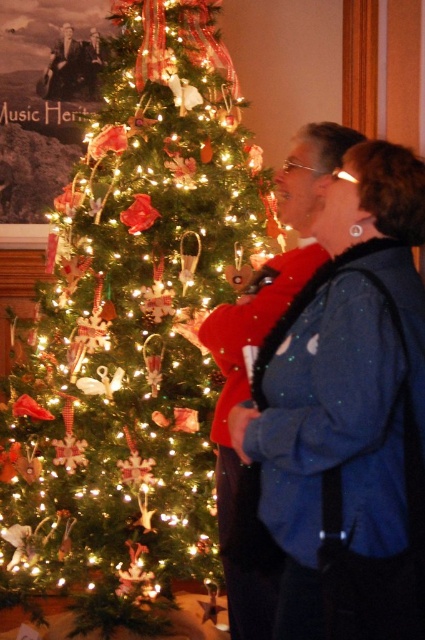
Consider the image. You are planning to take a photo of the green matte christmas tree at left and the blue sequined jacket at center. Which object should you focus on first if you want to capture both in the same frame without moving the camera?

The green matte christmas tree at left is larger in size than the blue sequined jacket at center, so you should focus on the tree first to ensure it fits properly in the frame before adjusting for the jacket.

You are standing in front of the Christmas tree and want to take a photo of the blue sequined jacket at center and the green matte christmas tree at left. Can you see both objects clearly in the photo without any obstruction?

The blue sequined jacket at center is behind green matte christmas tree at left, so the tree will block part of the jacket in the photo, making it partially obscured. Therefore, you cannot see both clearly without obstruction.

You are standing in front of the Christmas tree and want to take a photo of the blue sequined jacket at center without the green matte christmas tree at left appearing in the shot. Is this possible?

The green matte christmas tree at left is located above the blue sequined jacket at center, so if you lower your camera angle to avoid capturing the area above the jacket, you can take a photo of the blue sequined jacket at center without the green matte christmas tree at left appearing in the shot.